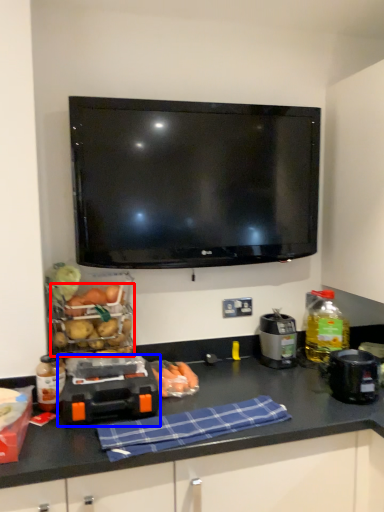
Question: Among these objects, which one is nearest to the camera, food (highlighted by a red box) or appliance (highlighted by a blue box)?

Choices:
 (A) food
 (B) appliance

Answer: (B)